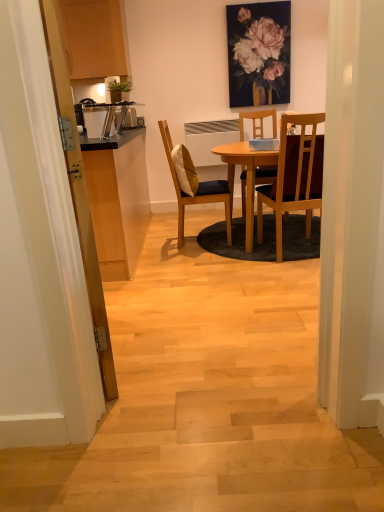
Looking at this image, measure the distance between point (168, 130) and camera.

Point (168, 130) and camera are 4.45 meters apart from each other.

The image size is (384, 512). What are the coordinates of `yellow fabric pillow at center` in the screenshot? It's located at pos(185,170).

Image resolution: width=384 pixels, height=512 pixels. What do you see at coordinates (185, 170) in the screenshot?
I see `yellow fabric pillow at center` at bounding box center [185, 170].

The image size is (384, 512). I want to click on transparent wooden door at left, so click(x=79, y=196).

Find the location of `wooden chair with cushion at center, the second chair in the right-to-left sequence`. wooden chair with cushion at center, the second chair in the right-to-left sequence is located at coordinates coord(197,190).

From the image's perspective, count 2nd chairs downward from the matte floral painting at upper center and point to it. Please provide its 2D coordinates.

[(294, 176)]

Is matte floral painting at upper center facing towards wooden chair at center, arranged as the first chair when viewed from the right?

Yes.

Is matte floral painting at upper center not close to wooden chair at center, the second chair from the left?

matte floral painting at upper center is far away from wooden chair at center, the second chair from the left.

Is matte floral painting at upper center positioned behind wooden chair at center, the second chair from the left?

Yes, it is behind wooden chair at center, the second chair from the left.

Based on the photo, is transparent wooden door at left placed right next to wooden chair with cushion at center, the first chair from the left?

There is a gap between transparent wooden door at left and wooden chair with cushion at center, the first chair from the left.

Is transparent wooden door at left completely or partially outside of wooden chair with cushion at center, the first chair from the left?

Yes.

Is transparent wooden door at left taller than wooden chair with cushion at center, the first chair from the left?

Correct, transparent wooden door at left is much taller as wooden chair with cushion at center, the first chair from the left.

Which of these two, transparent wooden door at left or matte floral painting at upper center, is thinner?

matte floral painting at upper center is thinner.

In the scene shown: Does transparent wooden door at left appear on the right side of matte floral painting at upper center?

No.

This screenshot has width=384, height=512. Find the location of `glass door located underneath the matte floral painting at upper center (from a real-world perspective)`. glass door located underneath the matte floral painting at upper center (from a real-world perspective) is located at coordinates (79, 196).

Can you tell me how much transparent wooden door at left and matte floral painting at upper center differ in facing direction?

111 degrees.

Choose the correct answer: Is matte floral painting at upper center inside wooden chair with cushion at center, the second chair in the right-to-left sequence, or outside it?

matte floral painting at upper center is not inside wooden chair with cushion at center, the second chair in the right-to-left sequence, it's outside.

Is matte floral painting at upper center closer to camera compared to wooden chair with cushion at center, the first chair from the left?

No, matte floral painting at upper center is behind wooden chair with cushion at center, the first chair from the left.

Looking at their sizes, would you say matte floral painting at upper center is wider or thinner than wooden chair with cushion at center, the second chair in the right-to-left sequence?

Clearly, matte floral painting at upper center has less width compared to wooden chair with cushion at center, the second chair in the right-to-left sequence.

Considering the points (239, 44) and (198, 187), which point is in front, point (239, 44) or point (198, 187)?

The point (198, 187) is closer.

Does wooden chair at center, arranged as the first chair when viewed from the right, come in front of wooden chair with cushion at center, the first chair from the left?

Yes, it is.

Looking at their sizes, would you say wooden chair at center, the second chair from the left, is wider or thinner than wooden chair with cushion at center, the second chair in the right-to-left sequence?

wooden chair at center, the second chair from the left, is thinner than wooden chair with cushion at center, the second chair in the right-to-left sequence.

Does point (289, 202) come behind point (178, 210)?

No, it is in front of (178, 210).

Find the location of a particular element. The width and height of the screenshot is (384, 512). chair located on the right of wooden chair with cushion at center, the first chair from the left is located at coordinates (294, 176).

Which object is wider, transparent wooden door at left or wooden chair at center, the second chair from the left?

wooden chair at center, the second chair from the left.

Is transparent wooden door at left positioned with its back to wooden chair at center, arranged as the first chair when viewed from the right?

No.

From the image's perspective, which one is positioned higher, transparent wooden door at left or wooden chair at center, the second chair from the left?

wooden chair at center, the second chair from the left, is shown above in the image.

Considering the sizes of transparent wooden door at left and wooden chair at center, arranged as the first chair when viewed from the right, in the image, is transparent wooden door at left taller or shorter than wooden chair at center, arranged as the first chair when viewed from the right,?

Clearly, transparent wooden door at left is taller compared to wooden chair at center, arranged as the first chair when viewed from the right.

Does matte floral painting at upper center have a smaller size compared to yellow fabric pillow at center?

Yes, matte floral painting at upper center is smaller than yellow fabric pillow at center.

Consider the image. Considering the sizes of objects matte floral painting at upper center and yellow fabric pillow at center in the image provided, who is taller, matte floral painting at upper center or yellow fabric pillow at center?

Standing taller between the two is matte floral painting at upper center.

Measure the distance from matte floral painting at upper center to yellow fabric pillow at center.

matte floral painting at upper center is 1.61 meters away from yellow fabric pillow at center.

From the image's perspective, which is above, matte floral painting at upper center or yellow fabric pillow at center?

From the image's view, matte floral painting at upper center is above.

Find the location of a particular element. The height and width of the screenshot is (512, 384). chair on the right of the matte floral painting at upper center is located at coordinates (294, 176).

The height and width of the screenshot is (512, 384). What are the coordinates of `chair that is the 2nd object located above the transparent wooden door at left (from the image's perspective)` in the screenshot? It's located at (197, 190).

When comparing their distances from yellow fabric pillow at center, does matte floral painting at upper center or transparent wooden door at left seem further?

Among the two, transparent wooden door at left is located further to yellow fabric pillow at center.

From the image, which object appears to be farther from yellow fabric pillow at center, wooden chair at center, the second chair from the left, or transparent wooden door at left?

transparent wooden door at left lies further to yellow fabric pillow at center than the other object.

Estimate the real-world distances between objects in this image. Which object is further from yellow fabric pillow at center, wooden chair at center, arranged as the first chair when viewed from the right, or matte floral painting at upper center?

matte floral painting at upper center lies further to yellow fabric pillow at center than the other object.

Based on their spatial positions, is transparent wooden door at left or wooden chair with cushion at center, the first chair from the left, further from yellow fabric pillow at center?

Based on the image, transparent wooden door at left appears to be further to yellow fabric pillow at center.

In the scene shown: Which object lies further to the anchor point wooden chair with cushion at center, the second chair in the right-to-left sequence, matte floral painting at upper center or transparent wooden door at left?

Among the two, transparent wooden door at left is located further to wooden chair with cushion at center, the second chair in the right-to-left sequence.

Based on the photo, from the image, which object appears to be farther from transparent wooden door at left, wooden chair at center, the second chair from the left, or yellow fabric pillow at center?

yellow fabric pillow at center is further to transparent wooden door at left.

Which object lies nearer to the anchor point yellow fabric pillow at center, matte floral painting at upper center or wooden chair at center, the second chair from the left?

Based on the image, wooden chair at center, the second chair from the left, appears to be nearer to yellow fabric pillow at center.

When comparing their distances from matte floral painting at upper center, does wooden chair at center, the second chair from the left, or yellow fabric pillow at center seem closer?

The object closer to matte floral painting at upper center is yellow fabric pillow at center.

Locate an element on the screen. The image size is (384, 512). pillow between transparent wooden door at left and matte floral painting at upper center from front to back is located at coordinates (185, 170).

Image resolution: width=384 pixels, height=512 pixels. I want to click on chair between transparent wooden door at left and wooden chair with cushion at center, the first chair from the left, from front to back, so click(x=294, y=176).

At what (x,y) coordinates should I click in order to perform the action: click on pillow between matte floral painting at upper center and wooden chair with cushion at center, the second chair in the right-to-left sequence, from top to bottom. Please return your answer as a coordinate pair (x, y). This screenshot has height=512, width=384. Looking at the image, I should click on (185, 170).

Image resolution: width=384 pixels, height=512 pixels. In order to click on chair between yellow fabric pillow at center and wooden chair at center, the second chair from the left in this screenshot , I will do `click(197, 190)`.